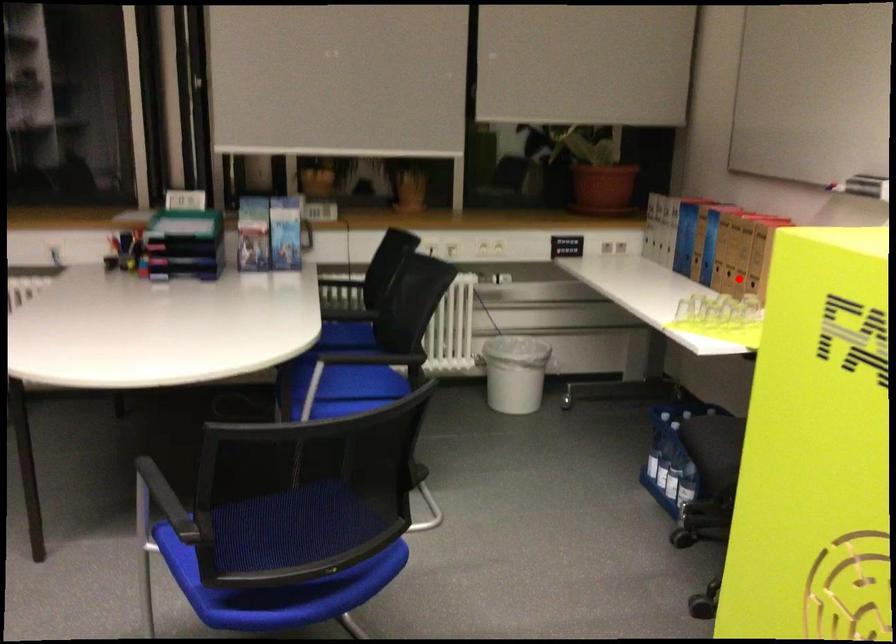
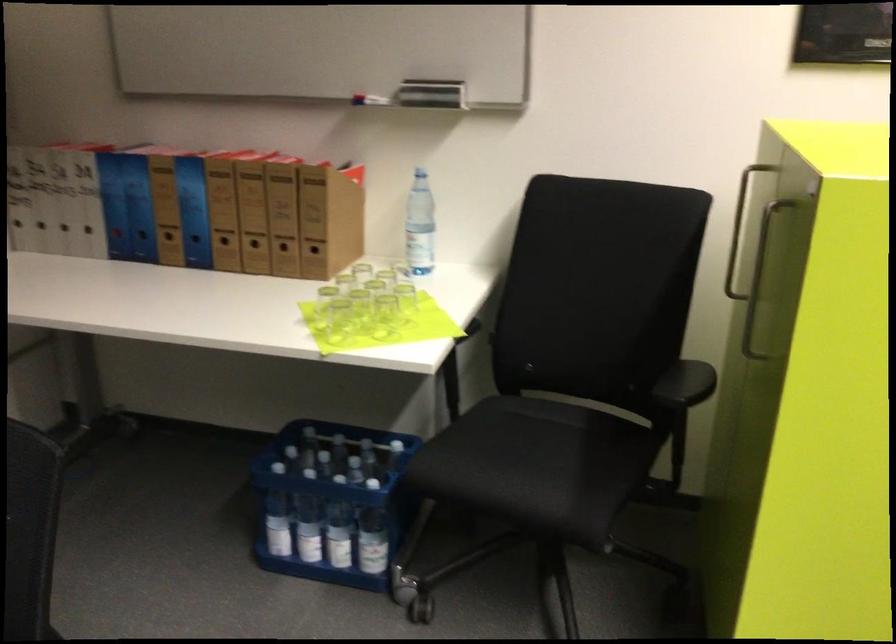
Where in the second image is the point corresponding to the highlighted location from the first image?

(283, 252)